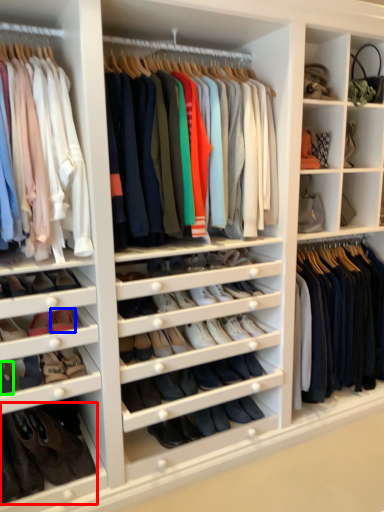
Question: Which object is positioned closest to footwear (highlighted by a red box)? Select from shoe (highlighted by a blue box) and shoe (highlighted by a green box).

Choices:
 (A) shoe
 (B) shoe

Answer: (B)